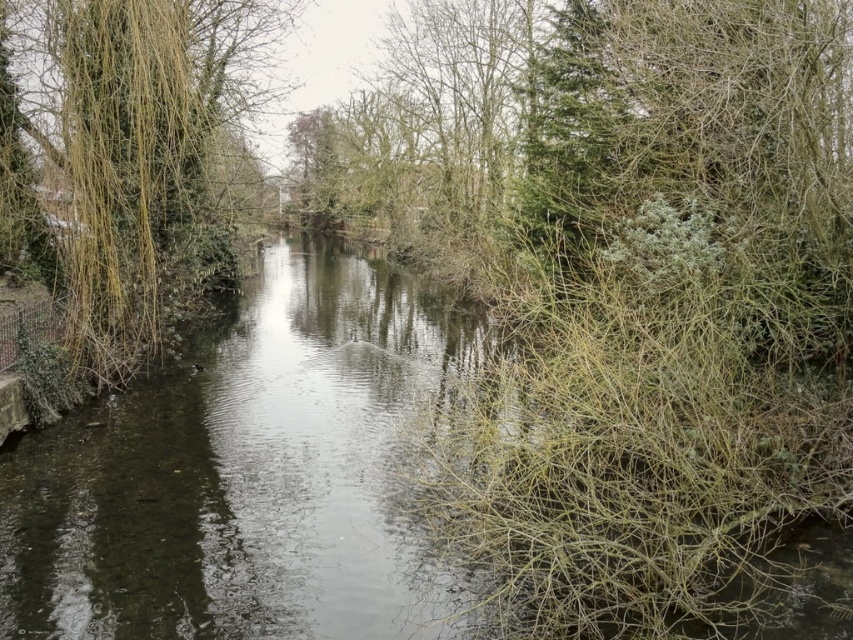
You are a kayaker paddling down the waterway. You notice the clear water at center and the green leafy tree at left. Which object is closer to you as you paddle forward?

The clear water at center is closer to you because it is in front of the green leafy tree at left.